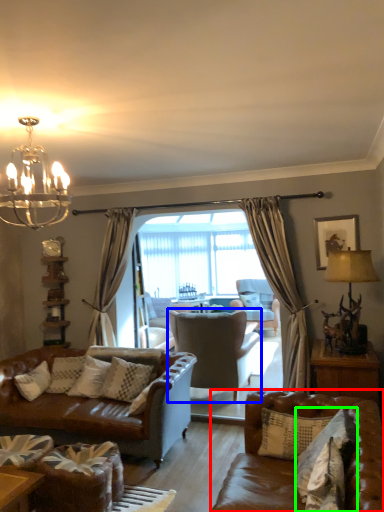
Question: Estimate the real-world distances between objects in this image. Which object is farther from studio couch (highlighted by a red box), chair (highlighted by a blue box) or pillow (highlighted by a green box)?

Choices:
 (A) chair
 (B) pillow

Answer: (A)